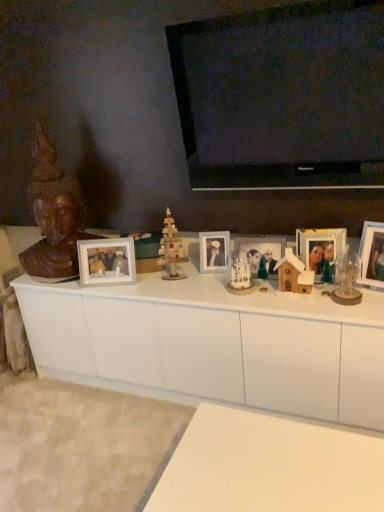
Image resolution: width=384 pixels, height=512 pixels. I want to click on unoccupied region to the right of white ceramic snowman at center, which is the 2th toy in left-to-right order, so click(x=269, y=288).